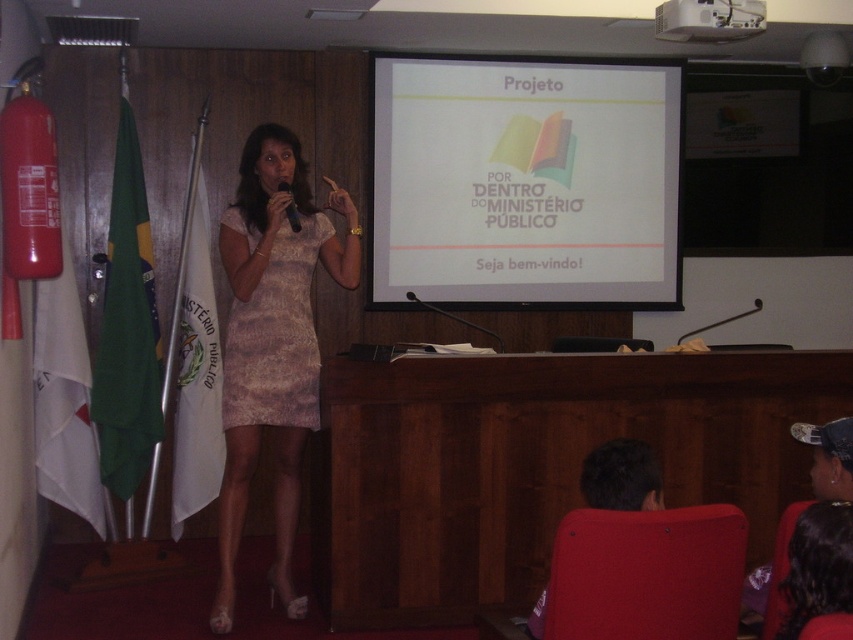
Is matte lace dress at center smaller than lace-like beige dress at center?

No.

Is point (235, 193) less distant than point (270, 388)?

No, it is not.

Find the location of a particular element. The image size is (853, 640). matte lace dress at center is located at coordinates (271, 342).

Can you confirm if lace-like beige dress at center is thinner than white plastic projector at upper center?

Indeed, lace-like beige dress at center has a lesser width compared to white plastic projector at upper center.

Is lace-like beige dress at center closer to camera compared to white plastic projector at upper center?

Yes.

Who is more distant from viewer, [277,257] or [670,17]?

The point [670,17] is behind.

Locate an element on the screen. Image resolution: width=853 pixels, height=640 pixels. lace-like beige dress at center is located at coordinates (276, 337).

Who is positioned more to the left, white matte projection screen at center or lace-like beige dress at center?

From the viewer's perspective, lace-like beige dress at center appears more on the left side.

Where is `white matte projection screen at center`? This screenshot has width=853, height=640. white matte projection screen at center is located at coordinates (525, 182).

What do you see at coordinates (525, 182) in the screenshot? I see `white matte projection screen at center` at bounding box center [525, 182].

Where is `white matte projection screen at center`? The height and width of the screenshot is (640, 853). white matte projection screen at center is located at coordinates (525, 182).